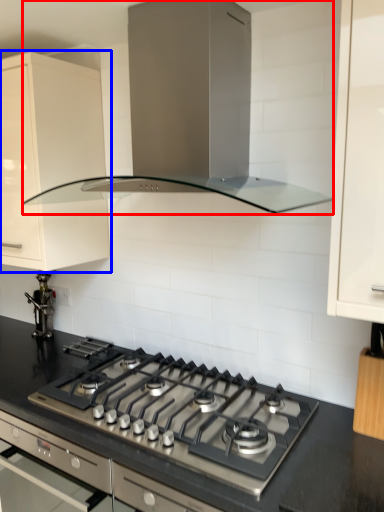
Question: Which object is further to the camera taking this photo, home appliance (highlighted by a red box) or cabinetry (highlighted by a blue box)?

Choices:
 (A) home appliance
 (B) cabinetry

Answer: (B)